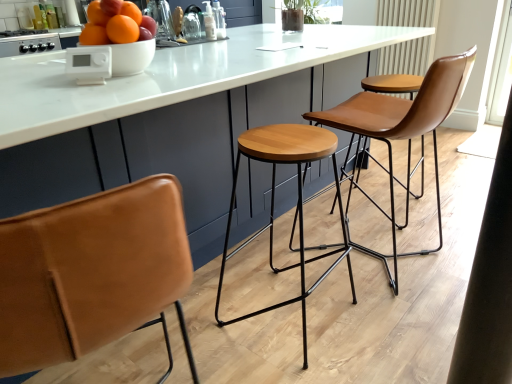
Find the location of a particular element. free space in front of white matte bowl at upper center is located at coordinates (87, 82).